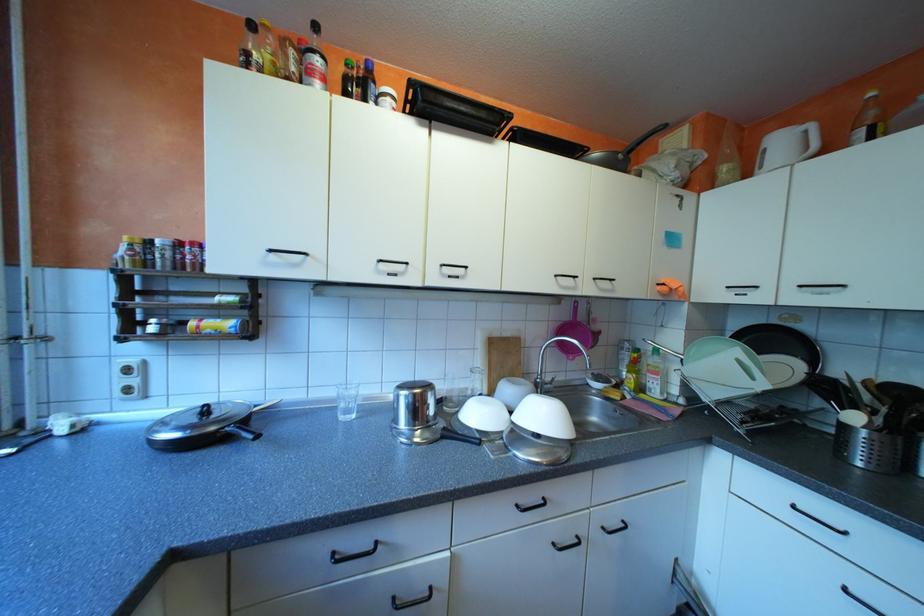
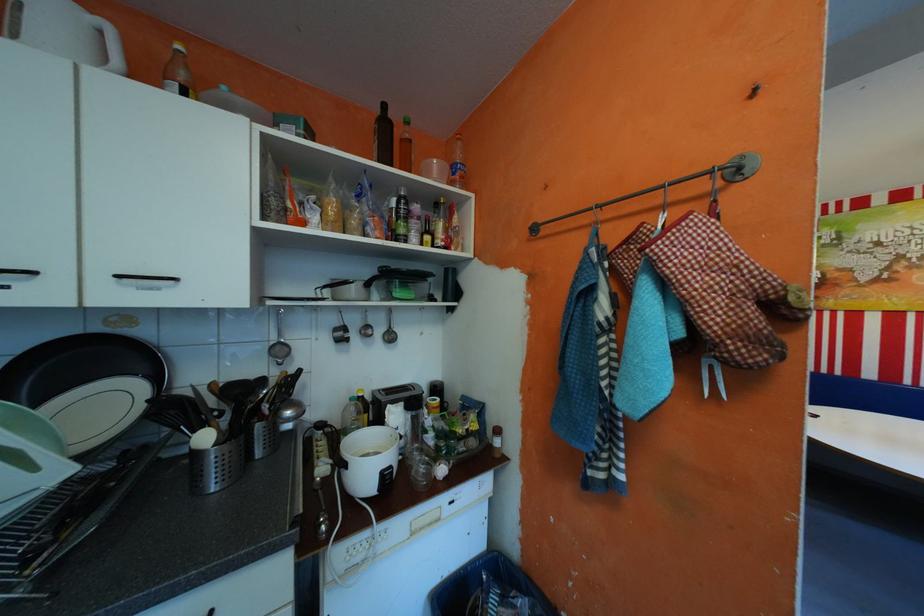
Locate, in the second image, the point that corresponds to point (812, 285) in the first image.

(130, 275)